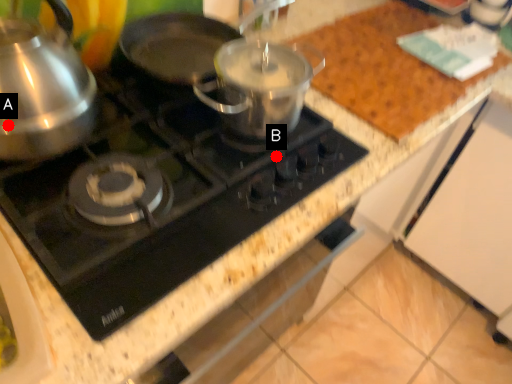
Question: Two points are circled on the image, labeled by A and B beside each circle. Which point is farther from the camera taking this photo?

Choices:
 (A) A is further
 (B) B is further

Answer: (B)